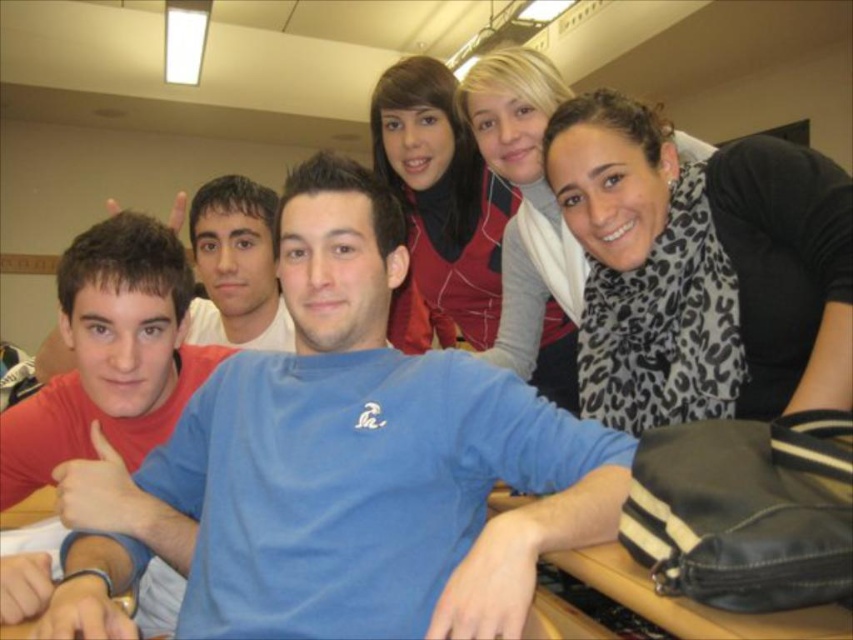
Is matte red sweater at upper center to the right of leopard print scarf at upper right from the viewer's perspective?

Incorrect, matte red sweater at upper center is not on the right side of leopard print scarf at upper right.

Identify the location of matte red sweater at upper center. The width and height of the screenshot is (853, 640). coord(440,204).

Does point (456, 122) come farther from viewer compared to point (210, 276)?

No.

Can you confirm if matte red sweater at upper center is wider than matte blue shirt at left?

Correct, the width of matte red sweater at upper center exceeds that of matte blue shirt at left.

Which is in front, point (457, 120) or point (234, 268)?

Point (457, 120) is more forward.

Where is `matte red sweater at upper center`? This screenshot has height=640, width=853. matte red sweater at upper center is located at coordinates (440, 204).

Is point (320, 448) behind point (508, 220)?

No, (320, 448) is in front of (508, 220).

Measure the distance between blue cotton shirt at center and camera.

blue cotton shirt at center is 26.94 inches away from camera.

Between point (422, 550) and point (561, 241), which one is positioned behind?

The point (561, 241) is behind.

The width and height of the screenshot is (853, 640). In order to click on blue cotton shirt at center in this screenshot , I will do `click(370, 456)`.